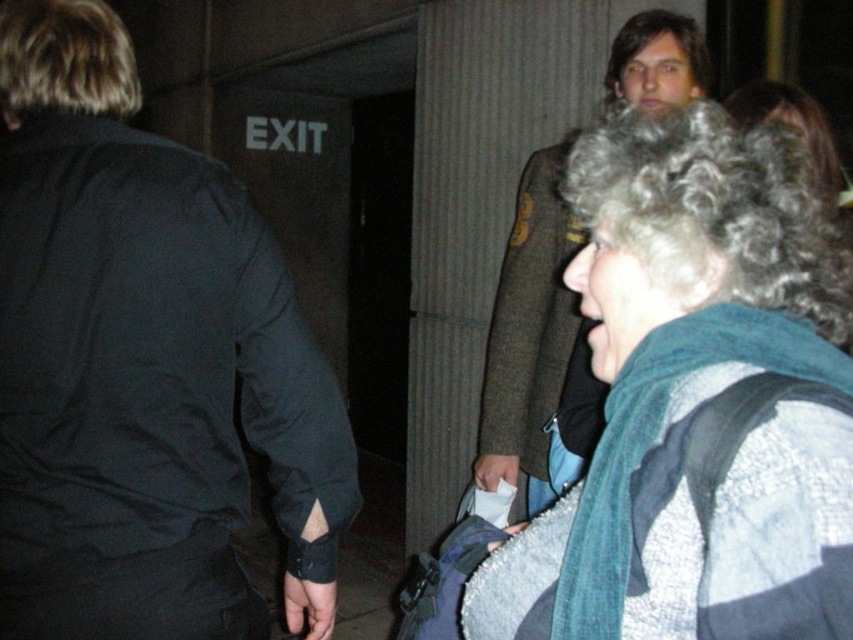
Which is below, black matte jacket at upper left or green wool coat at upper right?

black matte jacket at upper left

Can you confirm if black matte jacket at upper left is smaller than green wool coat at upper right?

Yes, black matte jacket at upper left is smaller than green wool coat at upper right.

Between point (184, 627) and point (531, 371), which one is positioned in front?

Positioned in front is point (184, 627).

At what (x,y) coordinates should I click in order to perform the action: click on black matte jacket at upper left. Please return your answer as a coordinate pair (x, y). The height and width of the screenshot is (640, 853). Looking at the image, I should click on (143, 364).

In the scene shown: Does gray wool scarf at upper right have a larger size compared to green wool coat at upper right?

No.

Between gray wool scarf at upper right and green wool coat at upper right, which one is positioned lower?

Positioned lower is gray wool scarf at upper right.

What do you see at coordinates (695, 394) in the screenshot? This screenshot has width=853, height=640. I see `gray wool scarf at upper right` at bounding box center [695, 394].

Identify the location of gray wool scarf at upper right. (695, 394).

Who is more distant from viewer, (241, 477) or (755, 132)?

Positioned behind is point (241, 477).

Can you confirm if black matte jacket at upper left is thinner than gray wool scarf at upper right?

No.

This screenshot has height=640, width=853. What do you see at coordinates (143, 364) in the screenshot? I see `black matte jacket at upper left` at bounding box center [143, 364].

What are the coordinates of `black matte jacket at upper left` in the screenshot? It's located at (143, 364).